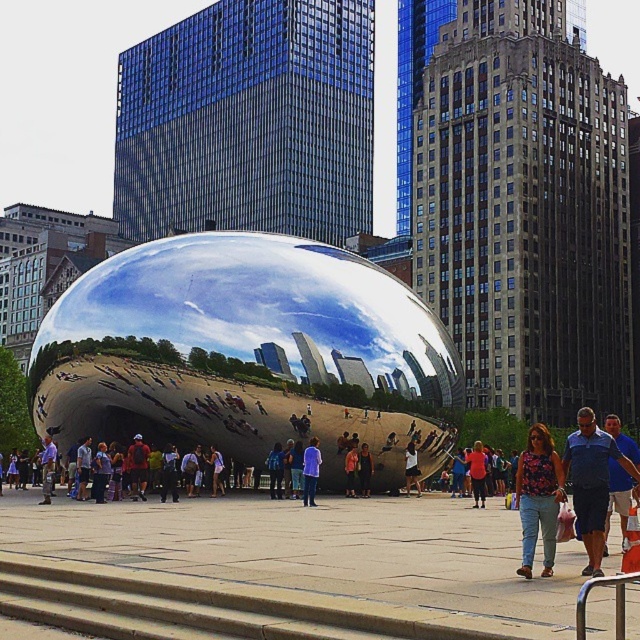
Is blue shirt at center positioned at the back of orange t-shirt at center?

No, blue shirt at center is closer to the viewer.

Is the position of blue shirt at center less distant than that of orange t-shirt at center?

Yes, blue shirt at center is in front of orange t-shirt at center.

Is point (620, 467) closer to camera compared to point (468, 467)?

Yes, point (620, 467) is closer to viewer.

Where is `blue shirt at center`? The width and height of the screenshot is (640, 640). blue shirt at center is located at coordinates (618, 497).

Can you confirm if blue shirt at center is positioned to the right of denim jacket at center?

Yes, blue shirt at center is to the right of denim jacket at center.

Does blue shirt at center have a larger size compared to denim jacket at center?

Correct, blue shirt at center is larger in size than denim jacket at center.

Between point (614, 413) and point (360, 488), which one is positioned in front?

Point (360, 488) is in front.

Identify the location of blue shirt at center. The width and height of the screenshot is (640, 640). (618, 497).

Which is above, blue denim shorts at lower right or red fabric jacket at center?

blue denim shorts at lower right

This screenshot has height=640, width=640. What do you see at coordinates (592, 483) in the screenshot?
I see `blue denim shorts at lower right` at bounding box center [592, 483].

I want to click on blue denim shorts at lower right, so click(x=592, y=483).